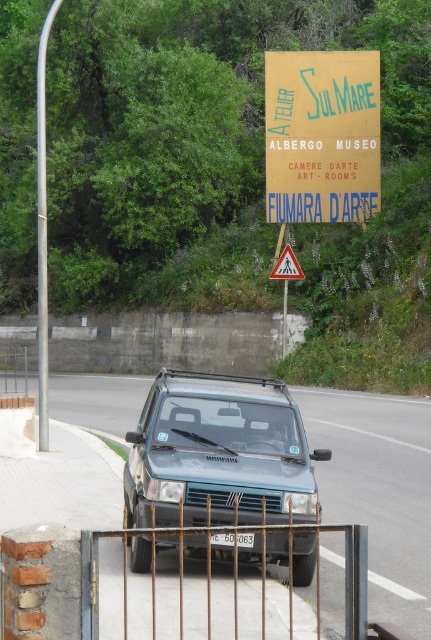
Is wooden signboard at upper center bigger than black plastic license plate at center?

Yes.

This screenshot has width=431, height=640. What are the coordinates of `wooden signboard at upper center` in the screenshot? It's located at (321, 134).

The width and height of the screenshot is (431, 640). I want to click on wooden signboard at upper center, so click(321, 134).

Who is lower down, teal matte suv at center or rusty metal gate at lower center?

teal matte suv at center

Can you confirm if teal matte suv at center is smaller than rusty metal gate at lower center?

Yes, teal matte suv at center is smaller than rusty metal gate at lower center.

Is point (306, 476) less distant than point (218, 628)?

No, it is behind (218, 628).

This screenshot has height=640, width=431. Find the location of `teal matte suv at center`. teal matte suv at center is located at coordinates (218, 452).

Between point (215, 376) and point (227, 540), which one is positioned in front?

Point (227, 540) is in front.

Does teal matte suv at center come in front of black plastic license plate at center?

No, it is not.

Between point (243, 554) and point (252, 547), which one is positioned behind?

Positioned behind is point (243, 554).

You are a GUI agent. You are given a task and a screenshot of the screen. Output one action in this format:
    pyautogui.click(x=<x>, y=<y>)
    Task: Click on the teal matte suv at center
    
    Given the screenshot: What is the action you would take?
    pyautogui.click(x=218, y=452)